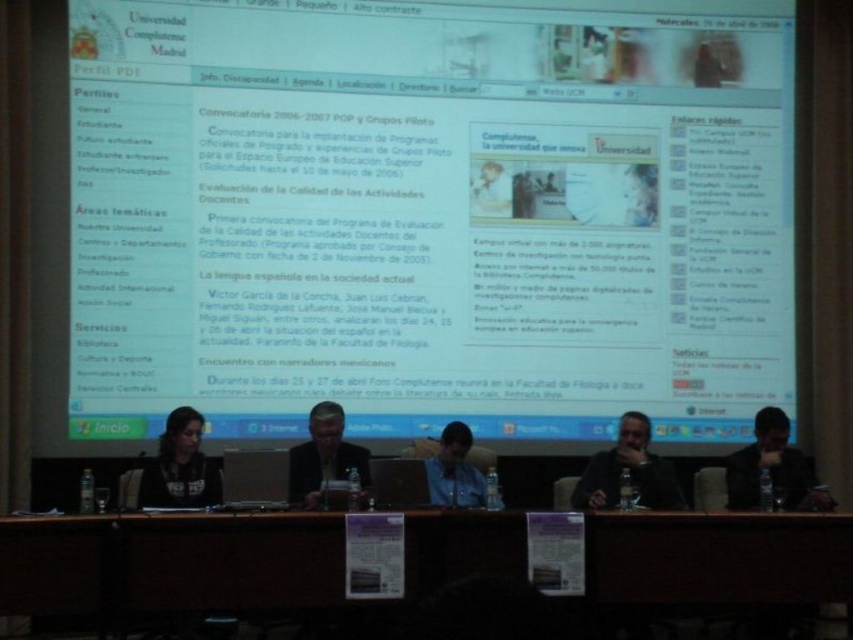
Question: Which point is farther from the camera taking this photo?

Choices:
 (A) (724, 516)
 (B) (451, 422)
 (C) (195, 474)

Answer: (B)

Question: Which point is closer to the camera?

Choices:
 (A) (181, 413)
 (B) (206, 540)
 (C) (447, 324)

Answer: (B)

Question: Is brown wood table at center below dark hair at right?

Choices:
 (A) no
 (B) yes

Answer: (B)

Question: Among these objects, which one is farthest from the camera?

Choices:
 (A) brown wood table at center
 (B) white glossy screen at upper center

Answer: (B)

Question: Can you confirm if white glossy screen at upper center is positioned to the right of dark gray jacket at upper center?

Choices:
 (A) no
 (B) yes

Answer: (A)

Question: Does dark hair at right appear under dark gray sweater at center?

Choices:
 (A) yes
 (B) no

Answer: (A)